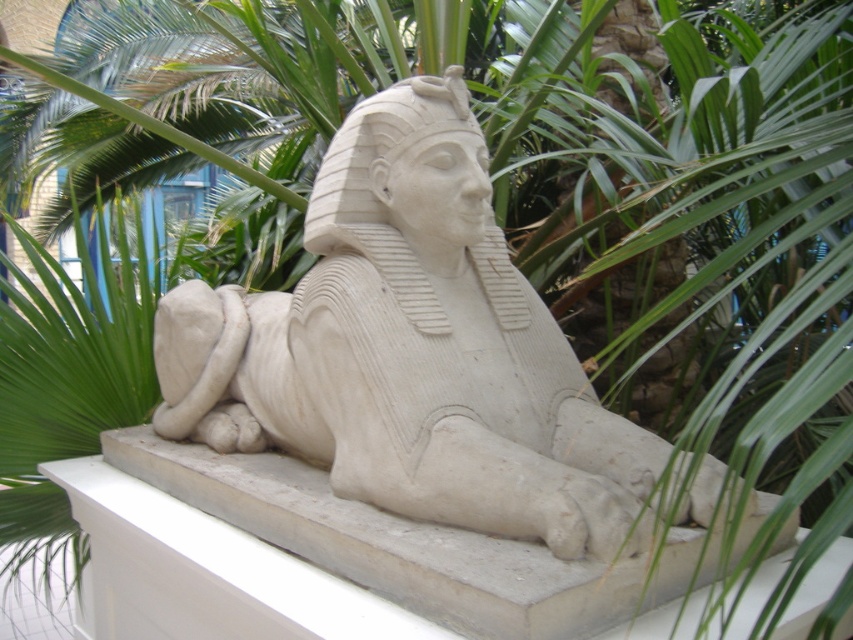
You are an archaeologist standing in front of the white stone sphinx at center. You want to place a small marker exactly at the base of the sphinx. Given that the pedestal is 1.2 meters tall, where should you place the marker relative to the pedestal?

The white stone sphinx at center is positioned at point (410, 348), so you should place the marker at the base of the pedestal directly below this point, which would be at coordinates (410, 348) minus the height of the pedestal. Since the pedestal is 1.2 meters tall, the marker should be placed 1.2 meters downward from the sphinx to the base.

You are an archaeologist examining the ancient site. You see the white stone sphinx at center and the white stone ledge at center. Which object is positioned to the right side?

The white stone sphinx at center is to the right of the white stone ledge at center.

You are an archaeologist examining the stone sphinx sculpture. You need to place a protective barrier around it to prevent further damage. The barrier must be placed at least 40 centimeters away from the sculpture to avoid contact. Based on the distance between the white stone sphinx at center and the white stone ledge at center, is the ledge suitable to anchor the barrier? Please explain your reasoning.

The white stone sphinx at center is 36.82 centimeters away from the white stone ledge at center. Since the required distance for the barrier is at least 40 centimeters, the ledge is too close to anchor the barrier as it does not meet the minimum distance requirement.